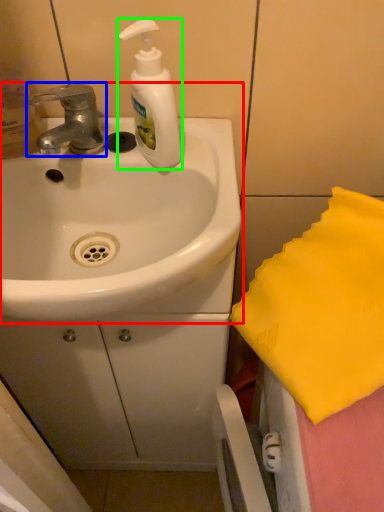
Question: Which object is positioned closest to sink (highlighted by a red box)? Select from tap (highlighted by a blue box) and soap dispenser (highlighted by a green box).

Choices:
 (A) tap
 (B) soap dispenser

Answer: (B)